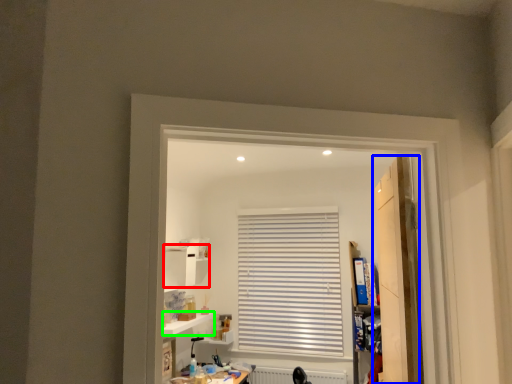
Question: Which object is positioned farthest from cabinet (highlighted by a red box)? Select from door (highlighted by a blue box) and window sill (highlighted by a green box).

Choices:
 (A) door
 (B) window sill

Answer: (A)